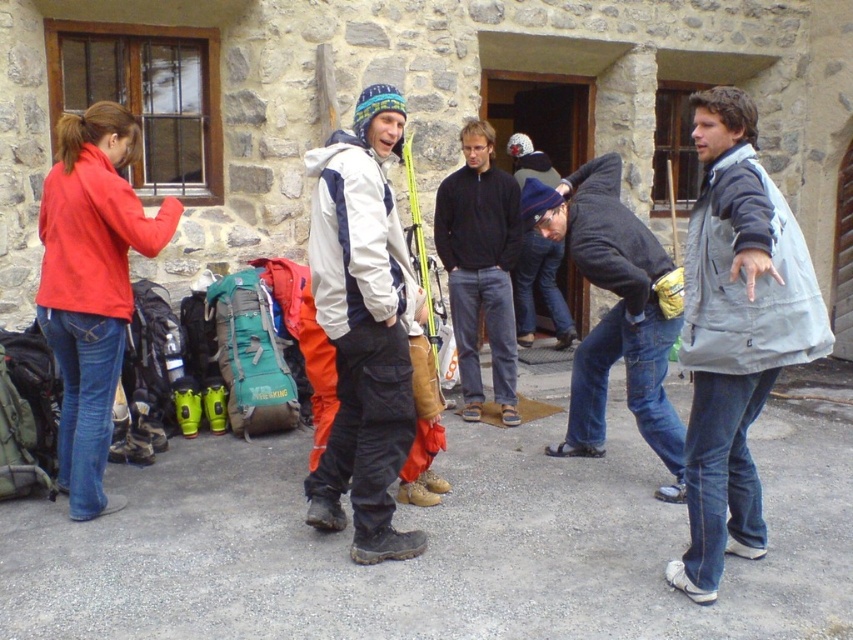
Question: Is gray matte jacket at right to the left of white matte jacket at center from the viewer's perspective?

Choices:
 (A) no
 (B) yes

Answer: (A)

Question: Is dark blue jeans at center further to camera compared to dark blue knit hat at center?

Choices:
 (A) yes
 (B) no

Answer: (B)

Question: Which point appears farthest from the camera in this image?

Choices:
 (A) (476, 237)
 (B) (532, 259)
 (C) (733, 486)
 (D) (403, 424)

Answer: (B)

Question: Which object is the farthest from the gray matte jacket at right?

Choices:
 (A) white matte jacket at center
 (B) dark blue jeans at center
 (C) dark blue knit hat at center

Answer: (C)

Question: Which object appears closest to the camera in this image?

Choices:
 (A) gray matte jacket at right
 (B) white matte jacket at center
 (C) dark blue knit hat at center

Answer: (A)

Question: Is dark blue jeans at center to the left of dark blue knit hat at center from the viewer's perspective?

Choices:
 (A) no
 (B) yes

Answer: (A)